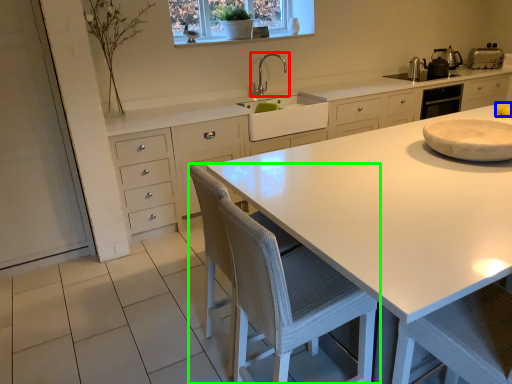
Question: Which object is the farthest from tap (highlighted by a red box)? Choose among these: food (highlighted by a blue box) or chair (highlighted by a green box).

Choices:
 (A) food
 (B) chair

Answer: (B)